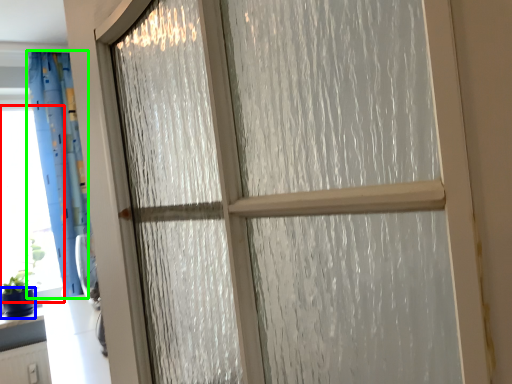
Question: Estimate the real-world distances between objects in this image. Which object is farther from window screen (highlighted by a red box), glass vase (highlighted by a blue box) or curtain (highlighted by a green box)?

Choices:
 (A) glass vase
 (B) curtain

Answer: (A)